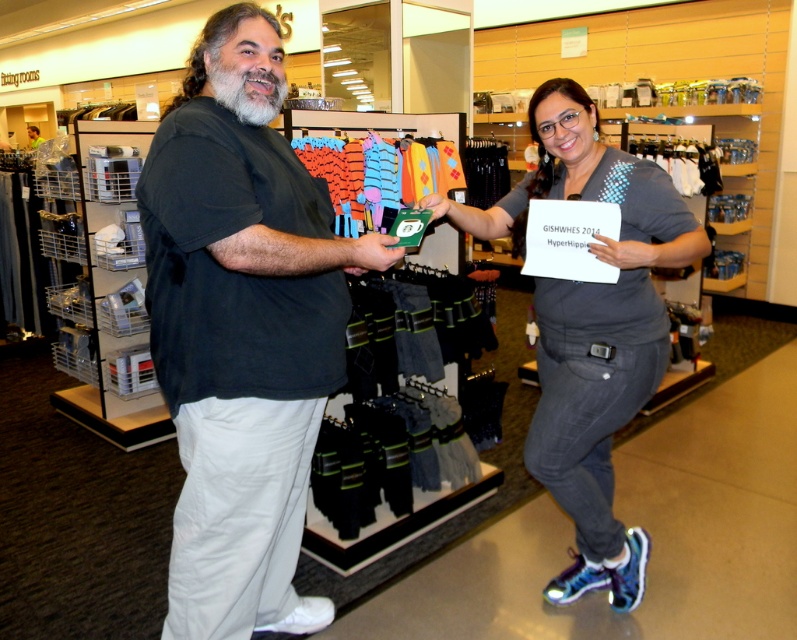
Question: Does black matte t-shirt at center have a larger size compared to gray denim jeans at center?

Choices:
 (A) no
 (B) yes

Answer: (B)

Question: Can you confirm if black matte t-shirt at center is positioned above gray denim jeans at center?

Choices:
 (A) yes
 (B) no

Answer: (B)

Question: Among these points, which one is nearest to the camera?

Choices:
 (A) (202, 397)
 (B) (548, 340)

Answer: (A)

Question: Is black matte t-shirt at center smaller than gray denim jeans at center?

Choices:
 (A) no
 (B) yes

Answer: (A)

Question: Which of the following is the closest to the observer?

Choices:
 (A) coord(305,412)
 (B) coord(556,369)

Answer: (A)

Question: Which point is farther to the camera?

Choices:
 (A) (538, 291)
 (B) (218, 104)

Answer: (A)